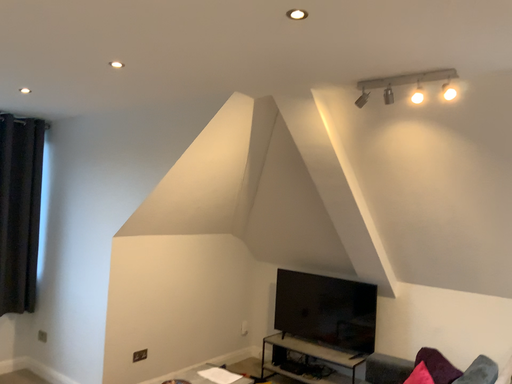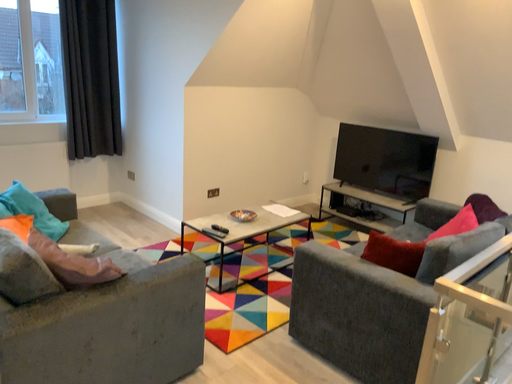
Question: Which way did the camera rotate in the video?

Choices:
 (A) rotated left
 (B) rotated right

Answer: (A)